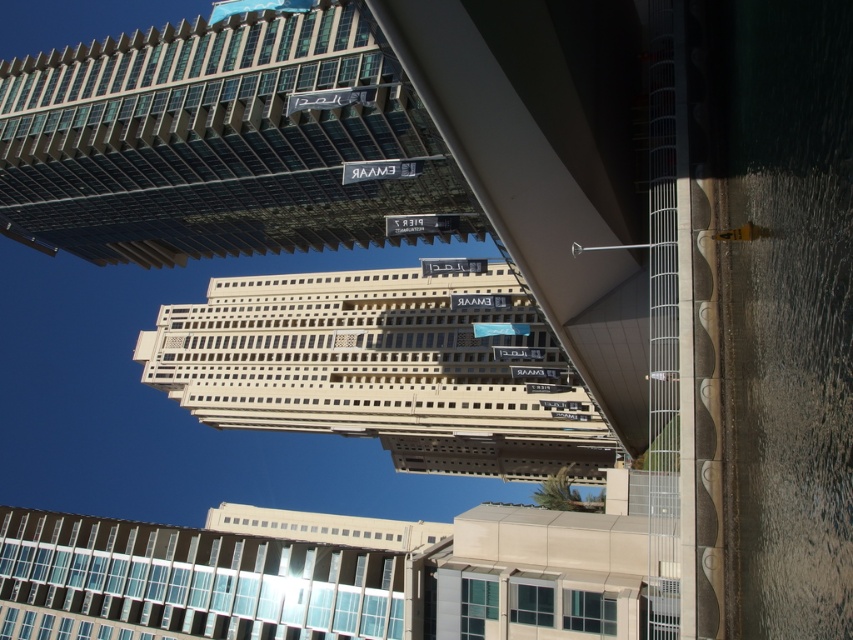
You are standing at the yellow fire hydrant on the paved walkway. You see two points marked in the scene. Which point is closer to you, point 1 at coordinates (x=149, y=196) or point 2 at coordinates (x=408, y=308)?

Point 1 at coordinates (x=149, y=196) is closer to you because it is in front of point 2 at coordinates (x=408, y=308).

You are a city planner analyzing the urban layout. Which of the two buildings, the glassy steel skyscraper at upper left or the white concrete building at center, has a narrower width?

The glassy steel skyscraper at upper left is thinner than the white concrete building at center, so it has a narrower width.